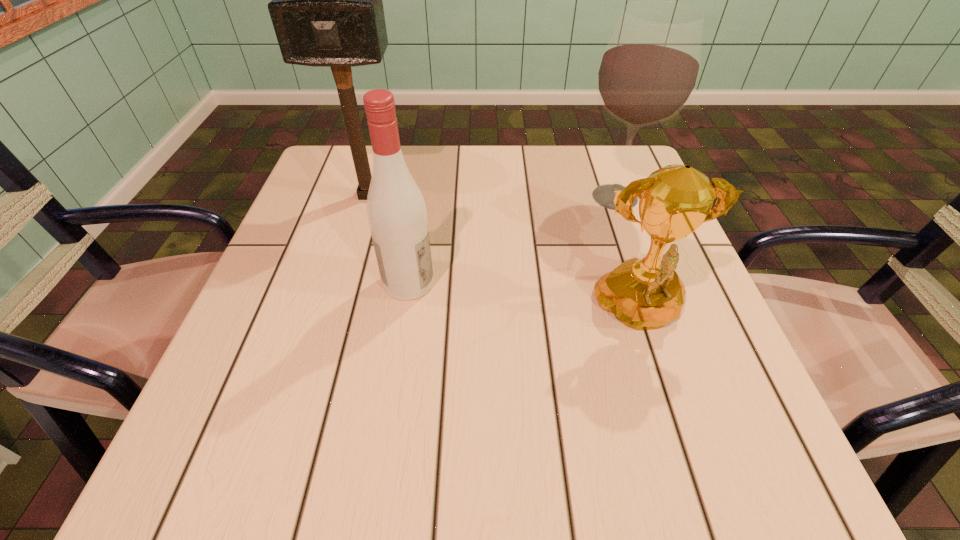
Locate an element on the screen. mallet is located at coordinates pyautogui.click(x=327, y=11).

Where is `the right alcohol`? The width and height of the screenshot is (960, 540). the right alcohol is located at coordinates (649, 70).

The width and height of the screenshot is (960, 540). What are the coordinates of `the nearer alcohol` in the screenshot? It's located at (396, 210).

You are a GUI agent. You are given a task and a screenshot of the screen. Output one action in this format:
    pyautogui.click(x=<x>, y=<y>)
    Task: Click on the shortest object
    
    Given the screenshot: What is the action you would take?
    pyautogui.click(x=644, y=294)

Find the location of `free spot located 0.290m on the right of the mallet`. free spot located 0.290m on the right of the mallet is located at coordinates (529, 195).

Identify the location of free space located 0.220m on the left of the farther alcohol. This screenshot has height=540, width=960. (481, 197).

I want to click on vacant area situated on the label of the nearer alcohol, so click(x=565, y=283).

At what (x,y) coordinates should I click in order to perform the action: click on vacant region located on the front side of the shortest object. Please return your answer as a coordinate pair (x, y). Looking at the image, I should click on (693, 478).

Find the location of a particular element. This screenshot has width=960, height=540. mallet that is at the far edge is located at coordinates (327, 11).

Find the location of `alcohol located at the far edge`. alcohol located at the far edge is located at coordinates (649, 70).